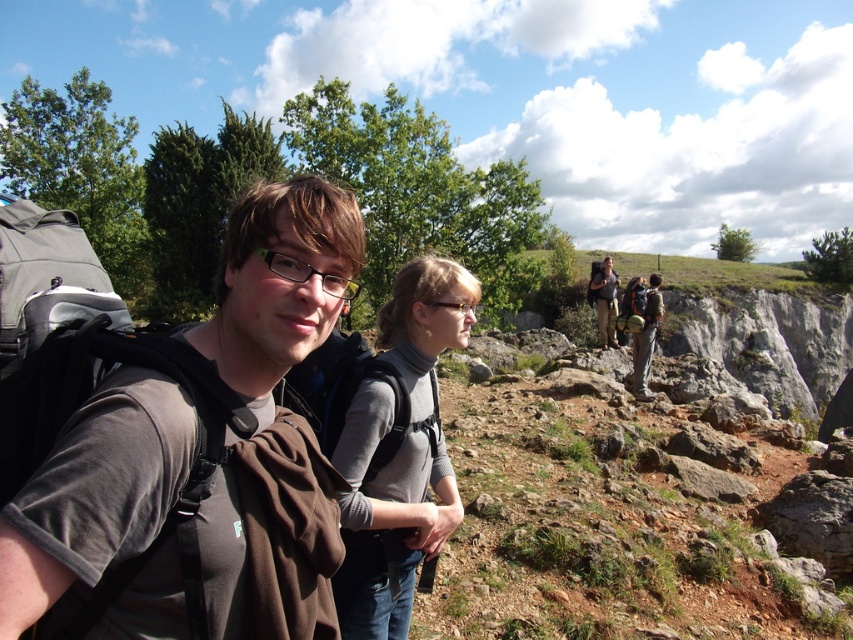
In the scene shown: You are a hiker trying to locate your backpack in the image. The dark gray fabric backpack at left is represented by point (183, 451). Where would you look to find it?

The dark gray fabric backpack at left is located at point (183, 451).

You are a photographer trying to capture the hikers in the image. You need to focus on the gray wool sweater at center and the khaki cotton pants at center. Which one should you adjust your camera focus on first if you want to ensure both are in focus?

Answer: The gray wool sweater at center is positioned under khaki cotton pants at center, so you should focus on the khaki cotton pants at center first since it is closer to the camera.

You are a hiker planning to carry both the dark gray fabric backpack at left and the khaki cotton pants at center. Based on their sizes, which item can you place on top of the other?

The dark gray fabric backpack at left is shorter than the khaki cotton pants at center, so the backpack can be placed on top of the pants.